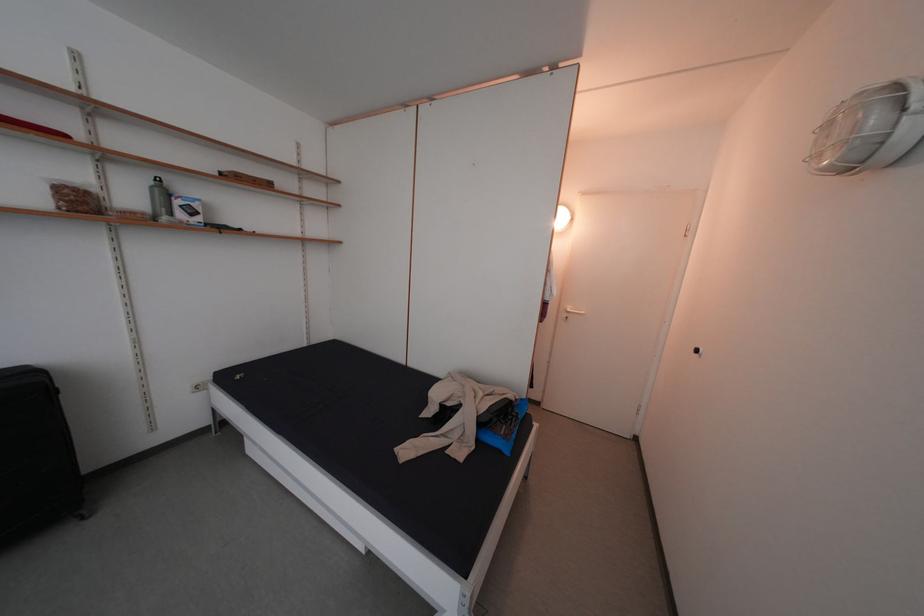
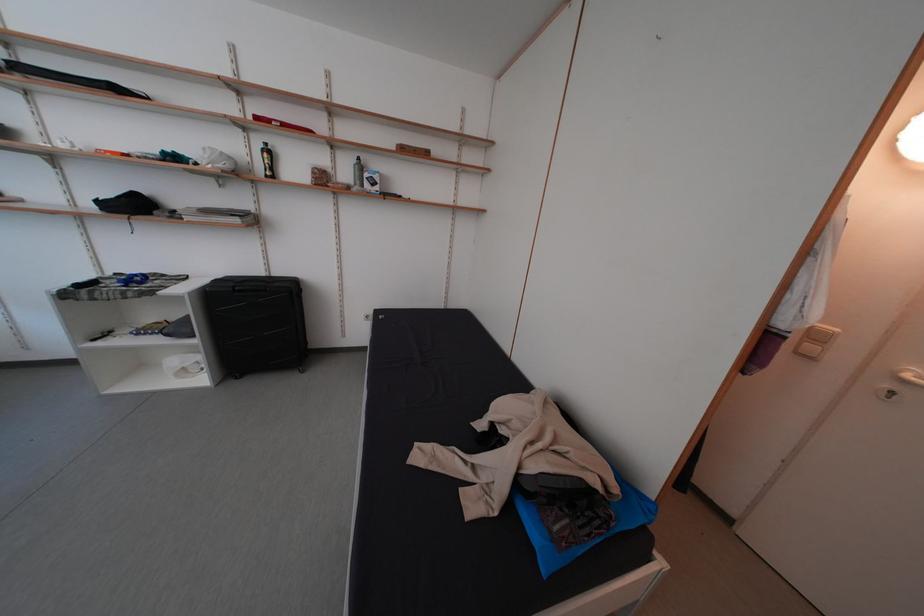
Question: The camera is either moving clockwise (left) or counter-clockwise (right) around the object. The first image is from the beginning of the video and the second image is from the end. Is the camera moving left or right when shooting the video?

Choices:
 (A) Left
 (B) Right

Answer: (B)